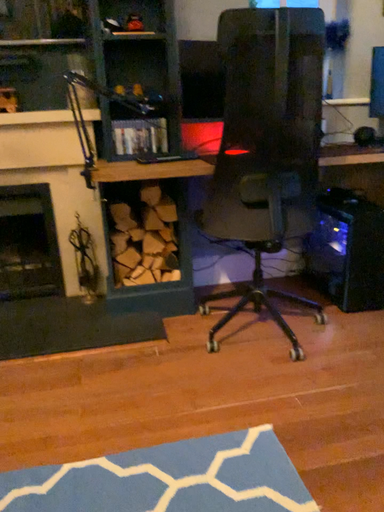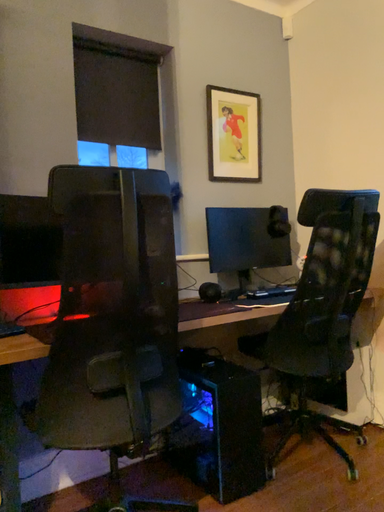
Question: How did the camera likely rotate when shooting the video?

Choices:
 (A) rotated upward
 (B) rotated downward

Answer: (A)